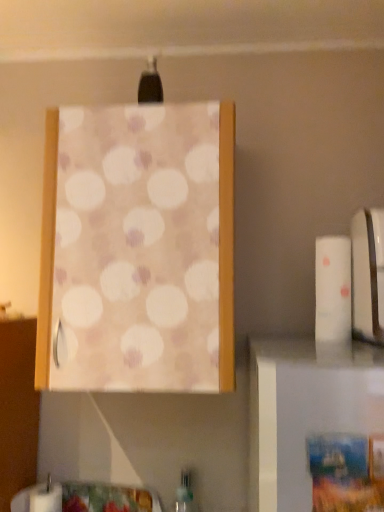
Question: In terms of height, does matte fabric curtain at upper center look taller or shorter compared to white matte toilet paper at right?

Choices:
 (A) tall
 (B) short

Answer: (A)

Question: From the image's perspective, is matte fabric curtain at upper center positioned above or below white matte toilet paper at right?

Choices:
 (A) above
 (B) below

Answer: (A)

Question: Which object is positioned closest to the wooden frame at upper center?

Choices:
 (A) white matte toilet paper at right
 (B) green translucent bottle at lower center
 (C) matte fabric curtain at upper center
 (D) white glossy toaster at right

Answer: (D)

Question: Which of these objects is positioned farthest from the green translucent bottle at lower center?

Choices:
 (A) wooden frame at upper center
 (B) white matte toilet paper at right
 (C) white glossy toaster at right
 (D) matte fabric curtain at upper center

Answer: (C)